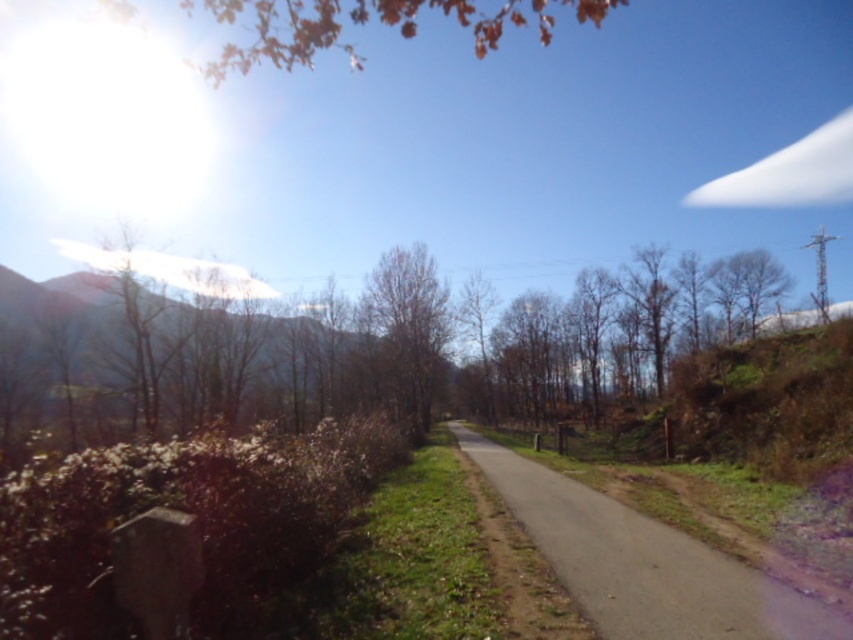
Question: Estimate the real-world distances between objects in this image. Which object is farther from the brown textured mountain at left?

Choices:
 (A) brown leafless tree at center
 (B) gray asphalt road at center

Answer: (B)

Question: Is gray asphalt road at center to the left of brown leafless tree at center from the viewer's perspective?

Choices:
 (A) no
 (B) yes

Answer: (A)

Question: Among these points, which one is nearest to the camera?

Choices:
 (A) (213, 316)
 (B) (753, 628)

Answer: (B)

Question: Does brown textured mountain at left appear over brown leafless tree at center?

Choices:
 (A) yes
 (B) no

Answer: (A)

Question: Which point is farther to the camera?

Choices:
 (A) (418, 337)
 (B) (149, 324)
 (C) (845, 628)

Answer: (A)

Question: Can you confirm if gray asphalt road at center is bigger than brown textured mountain at left?

Choices:
 (A) yes
 (B) no

Answer: (B)